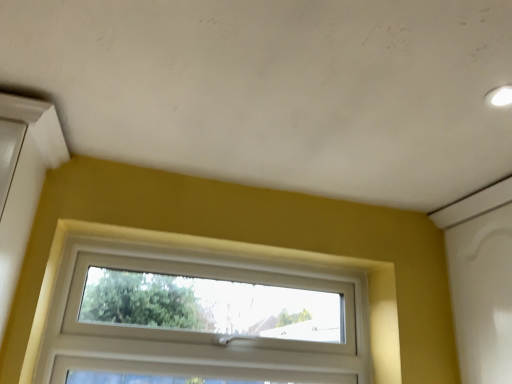
What do you see at coordinates (204, 332) in the screenshot? I see `white plastic window at center` at bounding box center [204, 332].

Identify the location of white plastic window at center. This screenshot has width=512, height=384. (204, 332).

The image size is (512, 384). In order to click on white plastic window at center in this screenshot , I will do `click(204, 332)`.